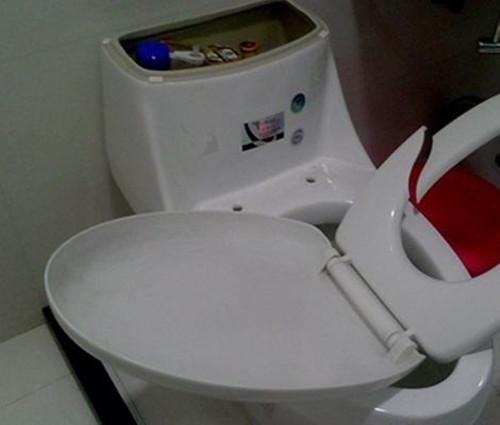
What are the coordinates of `pipe in toilet` in the screenshot? It's located at (244, 52).